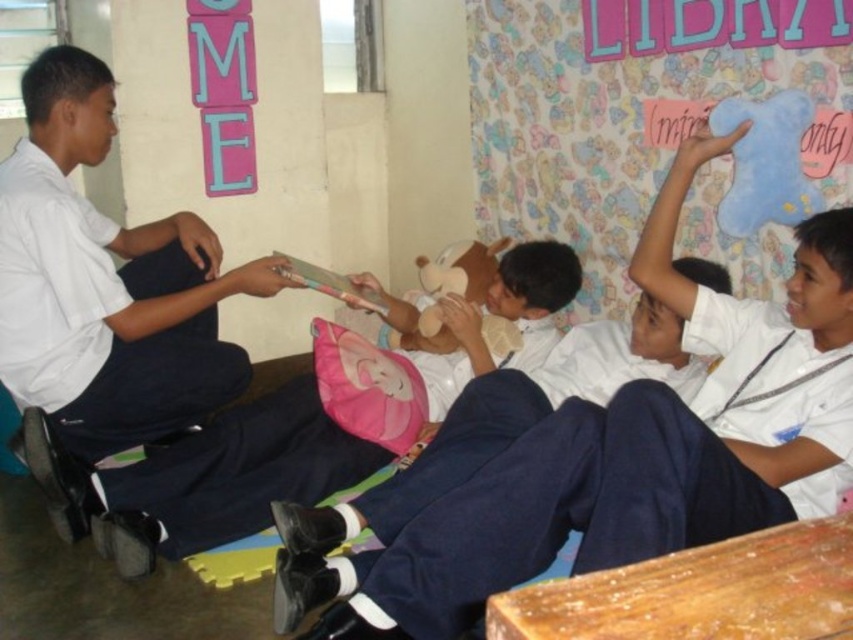
You are a teacher in the classroom and need to pass a book to the student wearing the white matte uniform at left and the student wearing the white uniform shirt at center. Given that the book is 12 inches long, can you place it between them so that both can reach it easily?

The distance between the white matte uniform at left and the white uniform shirt at center is 17.46 inches. Since the book is 12 inches long, placing it between them would leave some space, but both students should be able to reach it easily as the distance is greater than the book length.

You are standing in the library and see two points marked on the wall. The first point is at coordinates point (680, 492) and the second is at point (219, 467). Which point is closer to you?

Point (680, 492) is in front of point (219, 467), so it is closer to you.

You are a tailor measuring uniforms for children in the library. You have two uniforms to compare in the image. Which one has a wider width? The white matte uniform at center and the white matte uniform at left are both visible. Please answer based on their width.

The white matte uniform at center has a larger width than the white matte uniform at left according to the description.